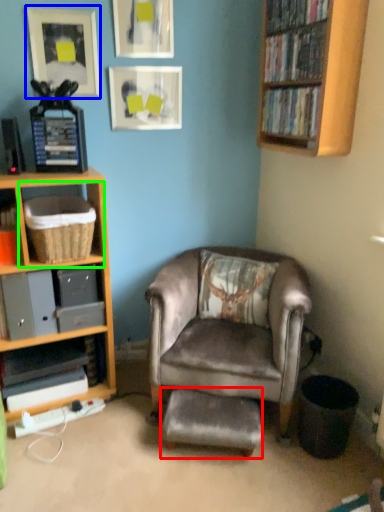
Question: Estimate the real-world distances between objects in this image. Which object is closer to footrest (highlighted by a red box), picture frame (highlighted by a blue box) or shelf (highlighted by a green box)?

Choices:
 (A) picture frame
 (B) shelf

Answer: (B)